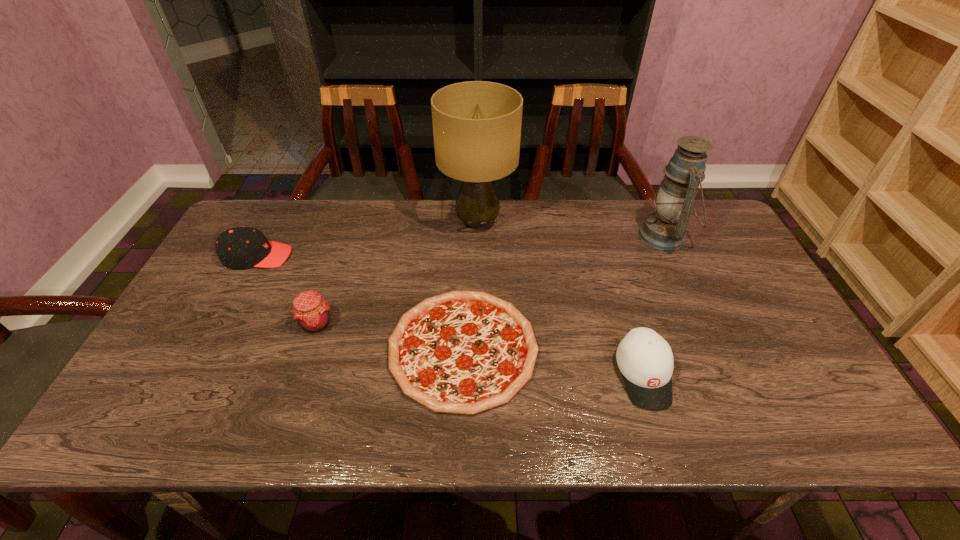
You are a GUI agent. You are given a task and a screenshot of the screen. Output one action in this format:
    pyautogui.click(x=<x>, y=<y>)
    Task: Click on the free point located 0.060m on the front-facing side of the fifth object from left to right
    The width and height of the screenshot is (960, 540).
    Given the screenshot: What is the action you would take?
    pyautogui.click(x=662, y=437)

Where is `vacant space located on the left of the fifth object from right to left`? Image resolution: width=960 pixels, height=540 pixels. vacant space located on the left of the fifth object from right to left is located at coordinates (273, 324).

What are the coordinates of `free region located 0.070m on the back of the pizza` in the screenshot? It's located at (466, 276).

At what (x,y) coordinates should I click in order to perform the action: click on lampshade present at the far edge. Please return your answer as a coordinate pair (x, y). This screenshot has width=960, height=540. Looking at the image, I should click on (476, 124).

You are a GUI agent. You are given a task and a screenshot of the screen. Output one action in this format:
    pyautogui.click(x=<x>, y=<y>)
    Task: Click on the oil lamp situated at the far edge
    The width and height of the screenshot is (960, 540).
    Given the screenshot: What is the action you would take?
    pyautogui.click(x=665, y=229)

I want to click on cap that is at the far edge, so click(240, 247).

Image resolution: width=960 pixels, height=540 pixels. In order to click on baseball cap located in the near edge section of the desktop in this screenshot , I will do `click(645, 359)`.

This screenshot has width=960, height=540. I want to click on pizza positioned at the near edge, so click(x=463, y=352).

Where is `object that is positioned at the left edge`? Image resolution: width=960 pixels, height=540 pixels. object that is positioned at the left edge is located at coordinates (240, 247).

The height and width of the screenshot is (540, 960). I want to click on object that is positioned at the right edge, so click(x=665, y=229).